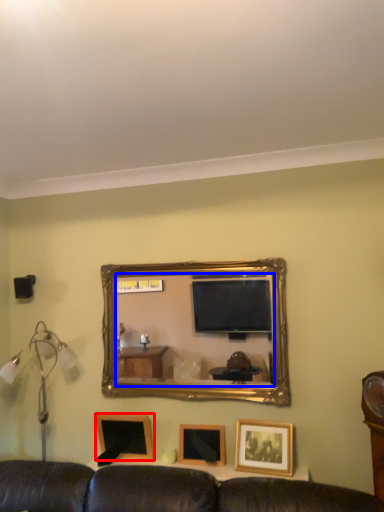
Question: Which object appears closest to the camera in this image, picture frame (highlighted by a red box) or mirror (highlighted by a blue box)?

Choices:
 (A) picture frame
 (B) mirror

Answer: (B)